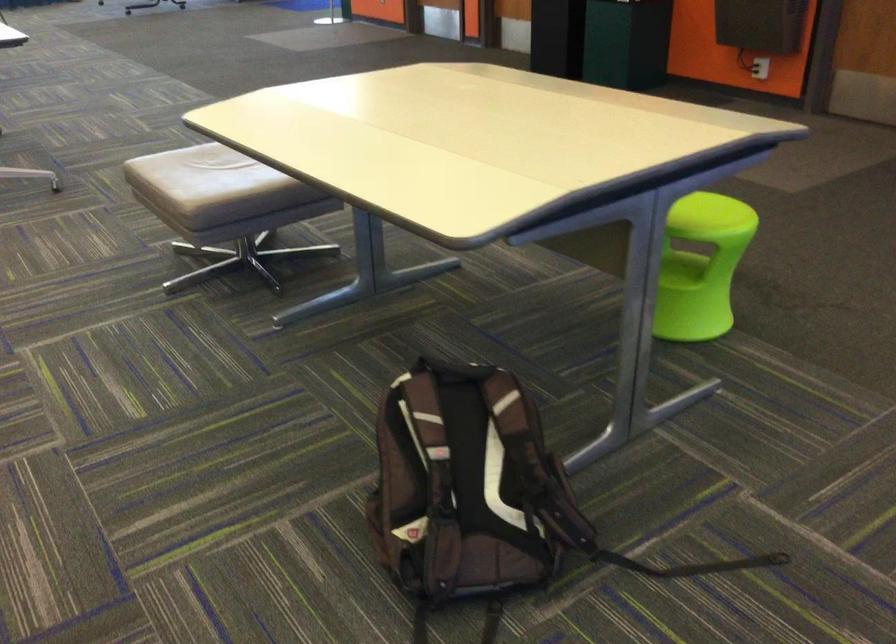
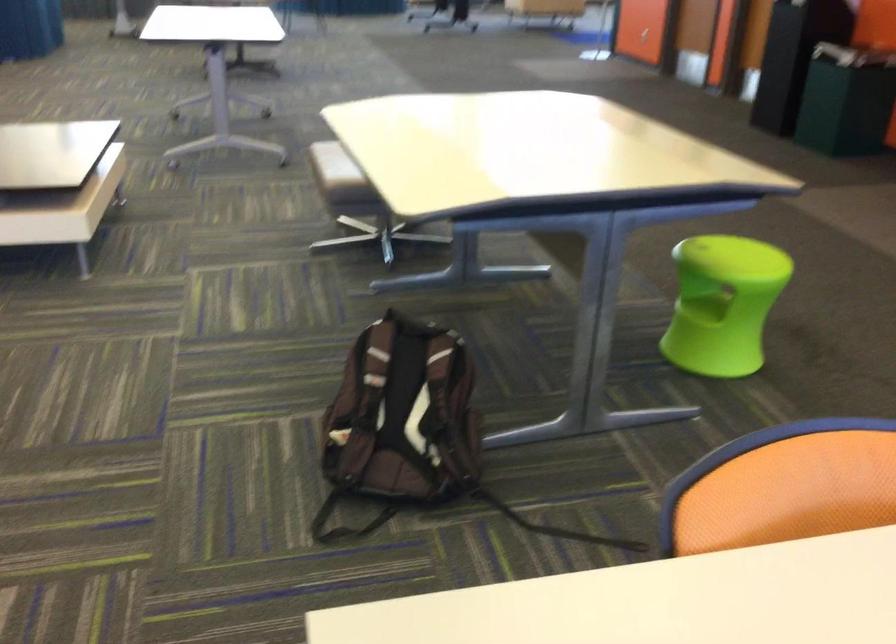
The point at (476,483) is marked in the first image. Where is the corresponding point in the second image?

(402, 413)